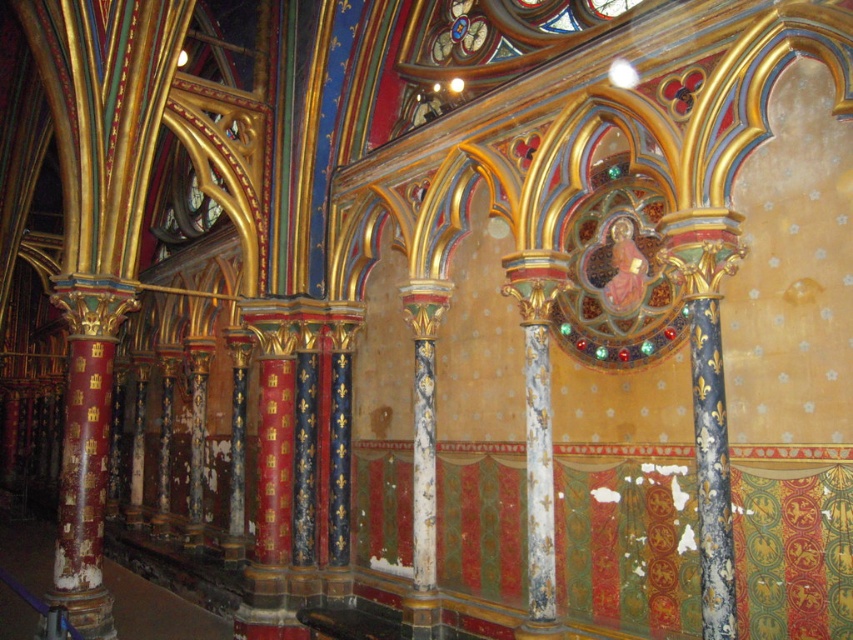
Does white painted wood column at center have a smaller size compared to white painted stone column at center?

No.

Can you confirm if white painted wood column at center is positioned to the right of white painted stone column at center?

Correct, you'll find white painted wood column at center to the right of white painted stone column at center.

The image size is (853, 640). Find the location of `white painted wood column at center`. white painted wood column at center is located at coordinates (537, 428).